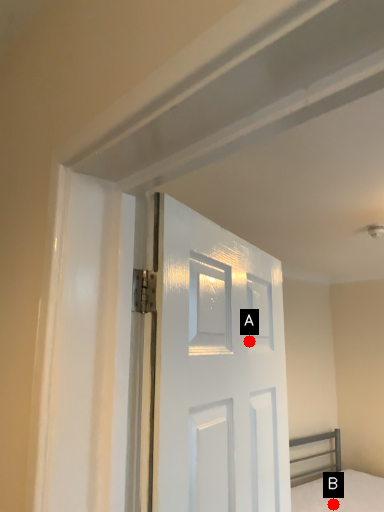
Question: Two points are circled on the image, labeled by A and B beside each circle. Among these points, which one is nearest to the camera?

Choices:
 (A) A is closer
 (B) B is closer

Answer: (A)